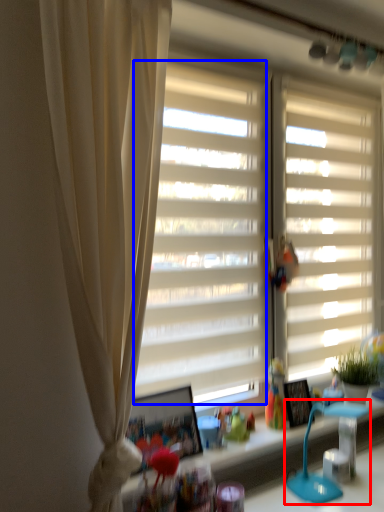
Question: Which object is closer to the camera taking this photo, table lamp (highlighted by a red box) or window screen (highlighted by a blue box)?

Choices:
 (A) table lamp
 (B) window screen

Answer: (A)